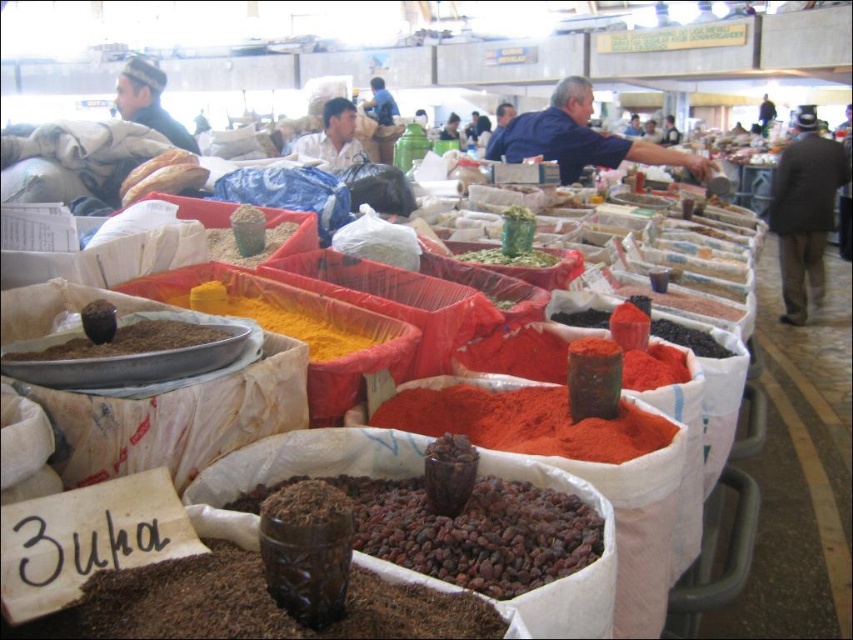
You are a customer at the market and want to locate the dark brown textured seeds at center. According to the coordinates provided, where exactly would you find them in the image?

The dark brown textured seeds at center are located at coordinates point (476, 532).

From the picture: You are a customer at the market and want to place an order for both the dark brown textured seeds at center and the green leafy at center. If your basket can only hold items within a 3.5 feet radius, can you reach both items without moving your basket?

The dark brown textured seeds at center and the green leafy at center are 3.84 feet apart, which is beyond the 3.5 feet radius of the basket. Therefore, you cannot reach both items without moving your basket.